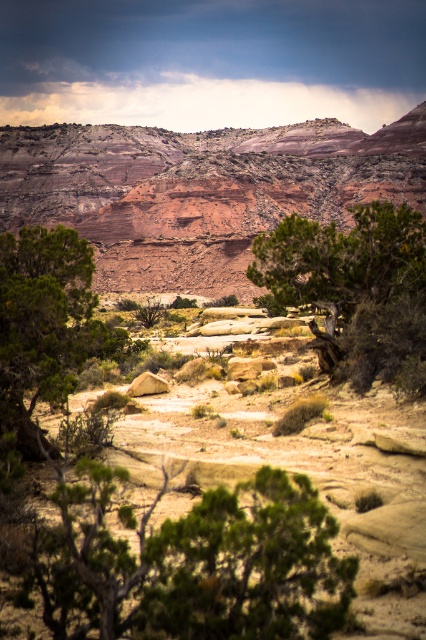
Who is positioned more to the right, green leafy tree at center or green matte tree at left?

green leafy tree at center

What do you see at coordinates (356, 285) in the screenshot?
I see `green leafy tree at center` at bounding box center [356, 285].

Measure the distance between green leafy tree at center and camera.

They are 57.02 meters apart.

This screenshot has height=640, width=426. I want to click on green leafy tree at center, so click(356, 285).

Is rustic sandstone mountain at center wider than green leafy tree at center?

Indeed, rustic sandstone mountain at center has a greater width compared to green leafy tree at center.

Based on the photo, who is taller, rustic sandstone mountain at center or green leafy tree at center?

rustic sandstone mountain at center is taller.

Which is behind, point (218, 195) or point (373, 372)?

Point (218, 195)

Where is `rustic sandstone mountain at center`? The width and height of the screenshot is (426, 640). rustic sandstone mountain at center is located at coordinates (199, 189).

Does point (333, 163) come behind point (48, 332)?

Yes.

Does rustic sandstone mountain at center appear on the right side of green matte tree at left?

Yes, rustic sandstone mountain at center is to the right of green matte tree at left.

Is point (345, 212) in front of point (13, 276)?

No, (345, 212) is further to viewer.

This screenshot has height=640, width=426. Identify the location of rustic sandstone mountain at center. (199, 189).